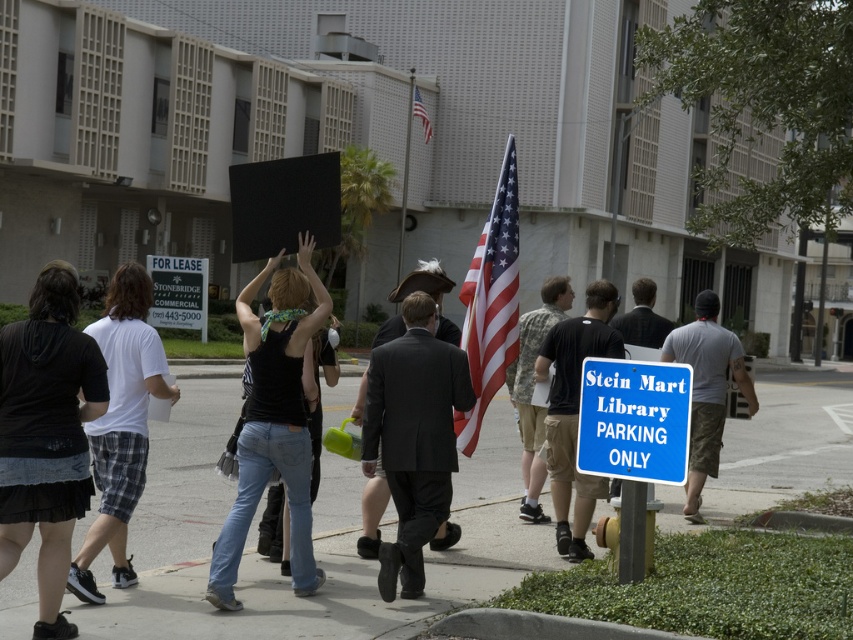
Question: Can you confirm if gray cotton t-shirt at center-right is thinner than camouflage shorts at center?

Choices:
 (A) yes
 (B) no

Answer: (B)

Question: Among these objects, which one is nearest to the camera?

Choices:
 (A) black cotton t-shirt at center
 (B) concrete sidewalk at center
 (C) black cotton hoodie at left
 (D) american flag at upper center

Answer: (C)

Question: Considering the real-world distances, which object is closest to the american flag at center?

Choices:
 (A) black matte tank top at center
 (B) white plastic sign at center left
 (C) dark gray suit at center

Answer: (C)

Question: Does concrete sidewalk at center have a lesser width compared to camouflage shorts at center?

Choices:
 (A) no
 (B) yes

Answer: (A)

Question: Among these objects, which one is nearest to the camera?

Choices:
 (A) black cotton t-shirt at center
 (B) gray cotton t-shirt at center-right

Answer: (A)

Question: Can you confirm if concrete sidewalk at center is wider than black cotton t-shirt at center?

Choices:
 (A) no
 (B) yes

Answer: (B)